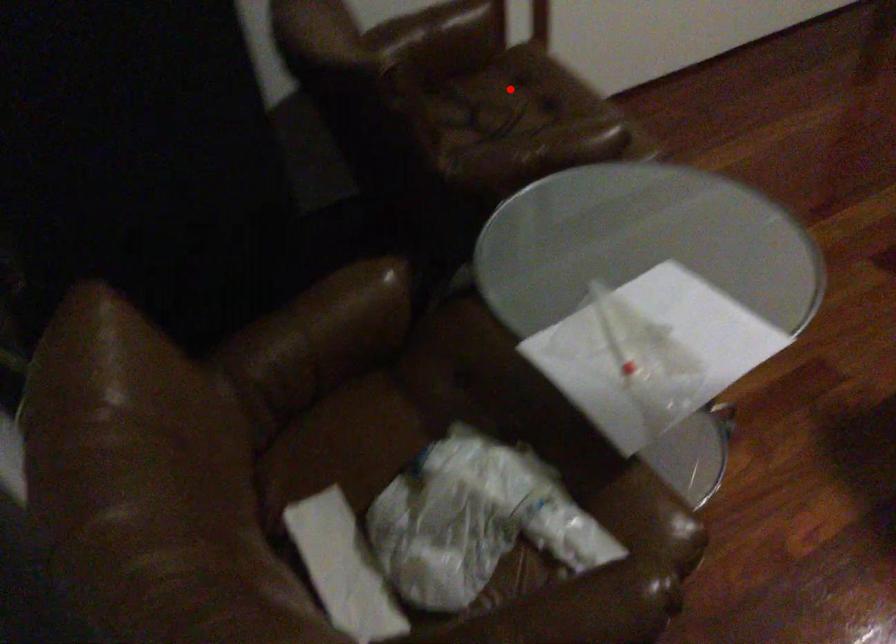
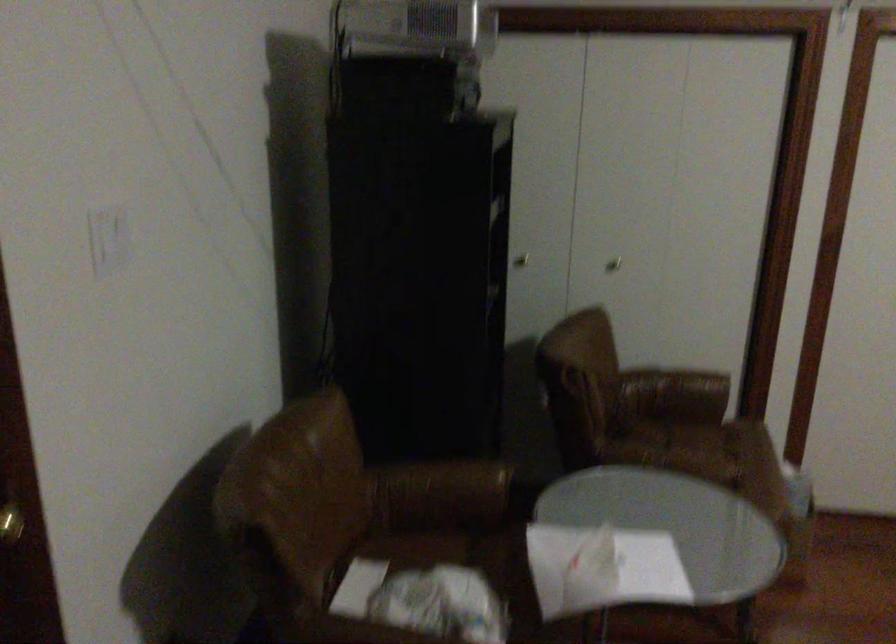
Question: A red point is marked in image1. In image2, is the corresponding 3D point closer to the camera or farther? Reply with the corresponding letter.

Choices:
 (A) The corresponding 3D point is closer.
 (B) The corresponding 3D point is farther.

Answer: (B)